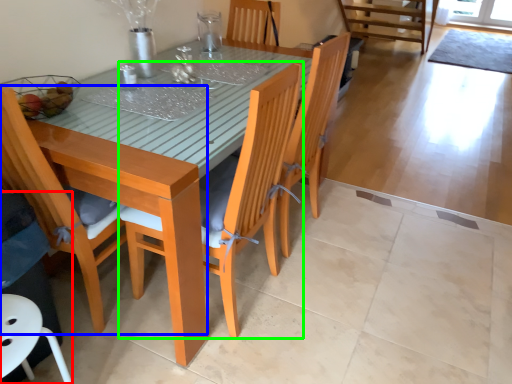
Question: Which object is the farthest from swivel chair (highlighted by a red box)? Choose among these: chair (highlighted by a blue box) or chair (highlighted by a green box).

Choices:
 (A) chair
 (B) chair

Answer: (B)